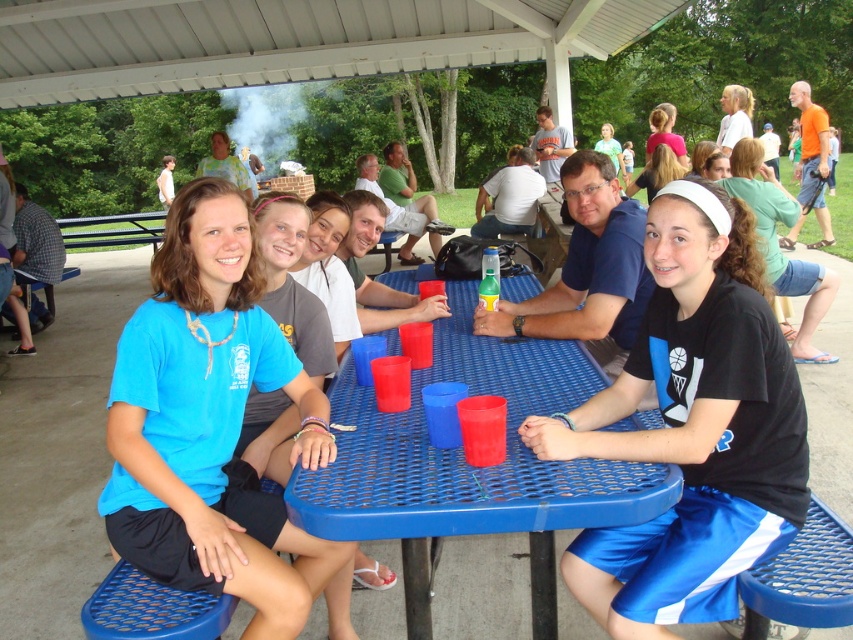
Which is behind, point (543, 627) or point (825, 280)?

The point (825, 280) is behind.

Locate an element on the screen. blue plastic table at center is located at coordinates (469, 465).

Is blue fabric shirt at center positioned before matte gray shirt at center?

Yes, it is in front of matte gray shirt at center.

Which is behind, point (206, 276) or point (347, 280)?

The point (347, 280) is behind.

I want to click on blue fabric shirt at center, so click(x=212, y=422).

Can you confirm if black matte shirt at center is positioned below blue plastic table at center?

No, black matte shirt at center is not below blue plastic table at center.

How far apart are black matte shirt at center and blue plastic table at center?

The distance of black matte shirt at center from blue plastic table at center is 13.17 inches.

The image size is (853, 640). What do you see at coordinates (692, 426) in the screenshot? I see `black matte shirt at center` at bounding box center [692, 426].

In order to click on black matte shirt at center in this screenshot , I will do `click(692, 426)`.